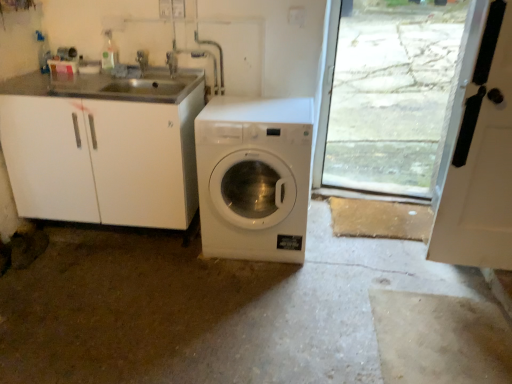
Where is `vacant area that lies in front of brushed metal faucet at upper center, the first faucet from the left`? The width and height of the screenshot is (512, 384). vacant area that lies in front of brushed metal faucet at upper center, the first faucet from the left is located at coordinates (140, 89).